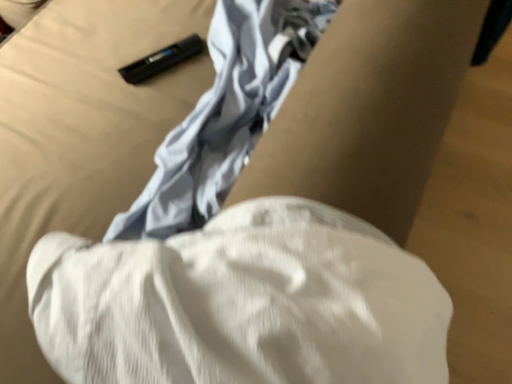
What do you see at coordinates (225, 113) in the screenshot? This screenshot has width=512, height=384. I see `white cotton shorts at center` at bounding box center [225, 113].

Measure the distance between point [239,118] and camera.

73.10 centimeters.

You are a GUI agent. You are given a task and a screenshot of the screen. Output one action in this format:
    pyautogui.click(x=<x>, y=<y>)
    Task: Click on the white cotton shorts at center
    
    Given the screenshot: What is the action you would take?
    pyautogui.click(x=225, y=113)

Identify the location of white cotton shorts at center. (225, 113).